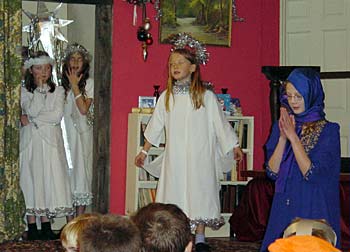
What are the coordinates of `white door` in the screenshot? It's located at (320, 48).